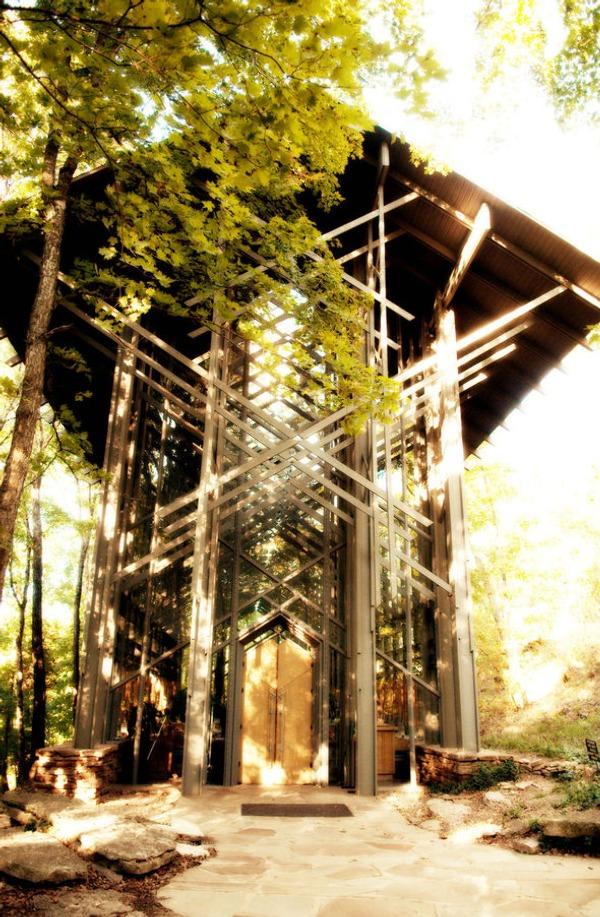
You are a GUI agent. You are given a task and a screenshot of the screen. Output one action in this format:
    pyautogui.click(x=<x>, y=<y>)
    Task: Click on the cross beams
    The width and height of the screenshot is (600, 917).
    Given the screenshot: What is the action you would take?
    pyautogui.click(x=290, y=444)